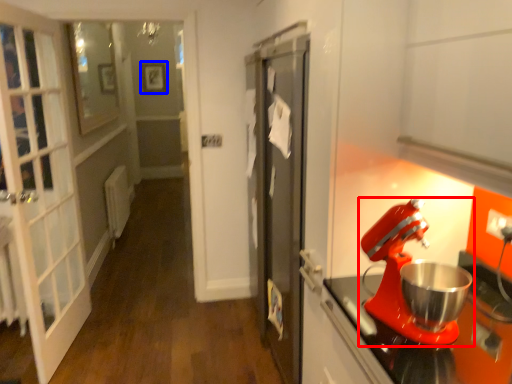
Question: Which of the following is the farthest to the observer, mixer (highlighted by a red box) or picture frame (highlighted by a blue box)?

Choices:
 (A) mixer
 (B) picture frame

Answer: (B)